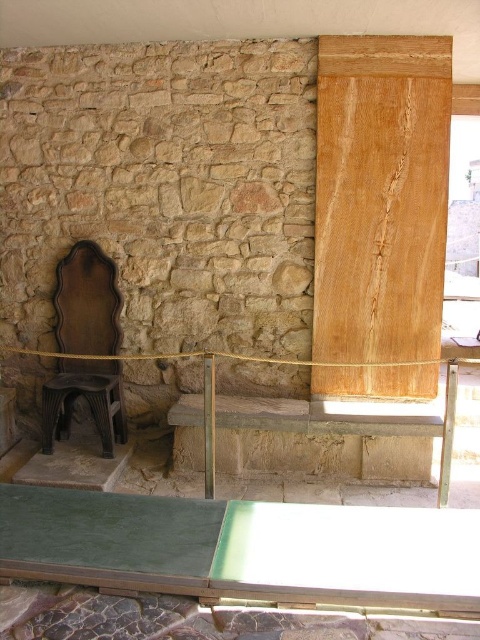
Question: Can you confirm if green glass table at lower center is wider than black plastic stool at lower left?

Choices:
 (A) no
 (B) yes

Answer: (B)

Question: Among these points, which one is nearest to the camera?

Choices:
 (A) (118, 397)
 (B) (78, 257)
 (C) (228, 512)

Answer: (C)

Question: Is dark brown wood chair at left below black plastic stool at lower left?

Choices:
 (A) no
 (B) yes

Answer: (A)

Question: From the image, what is the correct spatial relationship of dark brown wood chair at left in relation to black plastic stool at lower left?

Choices:
 (A) above
 (B) below

Answer: (A)

Question: Which point is farther from the camera taking this photo?

Choices:
 (A) (476, 525)
 (B) (86, 376)
 (C) (66, 396)

Answer: (B)

Question: Which point appears farthest from the camera in this image?

Choices:
 (A) (82, 316)
 (B) (103, 376)
 (C) (464, 556)

Answer: (A)